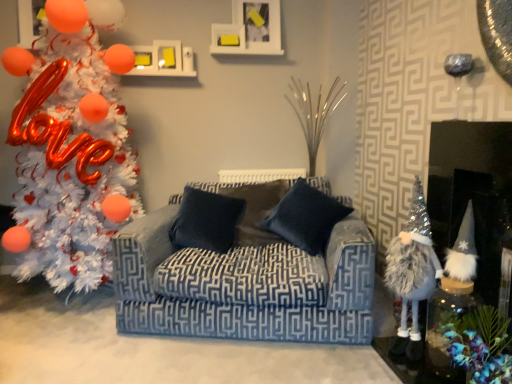
Question: Considering the positions of white tinsel christmas tree at left and fuzzy silver gnome at right, which is the first toy in left-to-right order, in the image, is white tinsel christmas tree at left wider or thinner than fuzzy silver gnome at right, which is the first toy in left-to-right order,?

Choices:
 (A) wide
 (B) thin

Answer: (A)

Question: Choose the correct answer: Is white tinsel christmas tree at left inside fuzzy silver gnome at right, which ranks as the second toy in right-to-left order, or outside it?

Choices:
 (A) inside
 (B) outside

Answer: (B)

Question: Estimate the real-world distances between objects in this image. Which object is closer to the fuzzy silver gnome at right, which is the first toy in left-to-right order?

Choices:
 (A) velvet blue couch at center
 (B) dark blue fabric pillow at center, the second pillow viewed from the right
 (C) white fluffy gnome at lower right
 (D) fuzzy silver gnome at right, which is the 2th toy in left-to-right order
 (E) white tinsel christmas tree at left

Answer: (D)

Question: Which object is the closest to the white tinsel christmas tree at left?

Choices:
 (A) fuzzy silver gnome at right, which ranks as the second toy in right-to-left order
 (B) velvet blue couch at center
 (C) white fluffy gnome at lower right
 (D) fuzzy silver gnome at right, which appears as the 1th toy when viewed from the right
 (E) dark blue fabric pillow at center, marked as the first pillow in a left-to-right arrangement

Answer: (E)